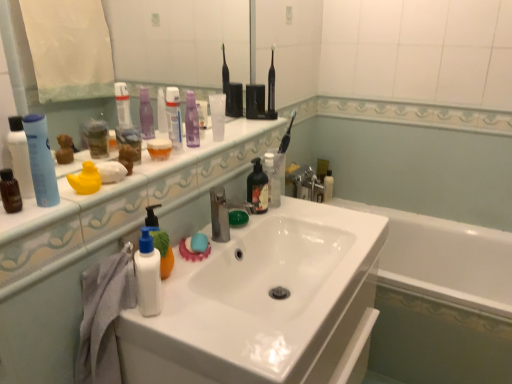
Locate an element on the screen. The height and width of the screenshot is (384, 512). vacant area on the back side of transparent plastic mouthwash at center, arranged as the fourth mouthwash when viewed from the front is located at coordinates (240, 130).